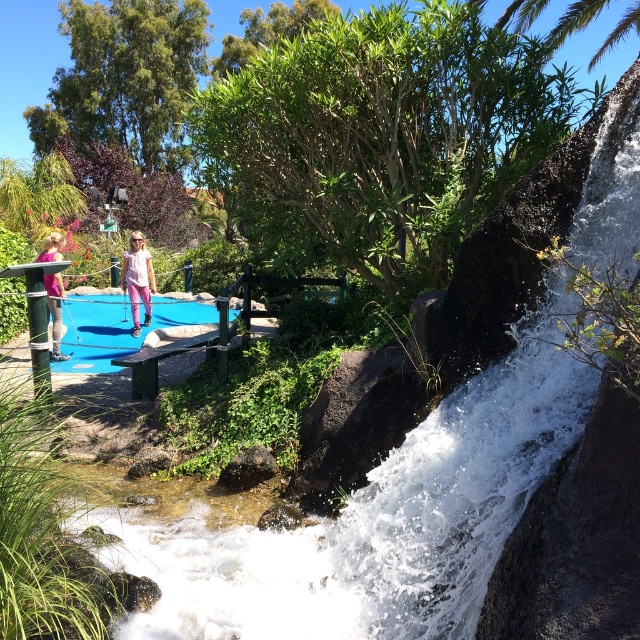
Question: Considering the relative positions of white frothy water at upper right and pink matte pants at left in the image provided, where is white frothy water at upper right located with respect to pink matte pants at left?

Choices:
 (A) right
 (B) left

Answer: (A)

Question: Which of the following is the farthest from the observer?

Choices:
 (A) white frothy water at upper right
 (B) pink fabric pants at left

Answer: (B)

Question: Does white frothy water at upper right appear over pink matte pants at left?

Choices:
 (A) yes
 (B) no

Answer: (B)

Question: Which object appears farthest from the camera in this image?

Choices:
 (A) pink matte pants at left
 (B) white frothy water at upper right

Answer: (A)

Question: From the image, what is the correct spatial relationship of white frothy water at upper right in relation to pink matte pants at left?

Choices:
 (A) above
 (B) below

Answer: (B)

Question: Which point is farther from the camera taking this photo?

Choices:
 (A) (64, 353)
 (B) (145, 252)

Answer: (B)